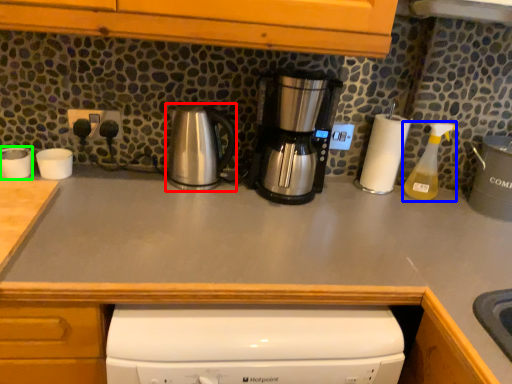
Question: Considering the real-world distances, which object is closest to kitchen appliance (highlighted by a red box)? bottle (highlighted by a blue box) or appliance (highlighted by a green box).

Choices:
 (A) bottle
 (B) appliance

Answer: (B)